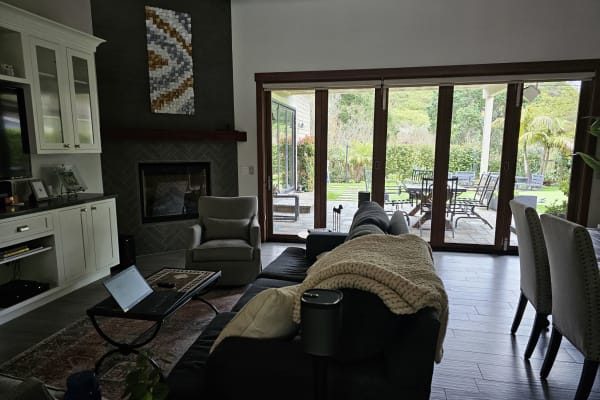
At what (x,y) coordinates should I click in order to perform the action: click on wood frame. Please return your answer as a coordinate pair (x, y). The image size is (600, 400). Looking at the image, I should click on (432, 232), (374, 183), (320, 187), (516, 182).